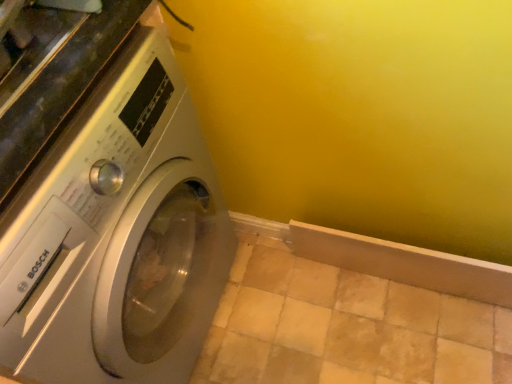
Describe the element at coordinates (103, 200) in the screenshot. I see `satin silver washing machine at left` at that location.

Where is `satin silver washing machine at left`? This screenshot has height=384, width=512. satin silver washing machine at left is located at coordinates (103, 200).

Locate an element on the screen. Image resolution: width=512 pixels, height=384 pixels. satin silver washing machine at left is located at coordinates (103, 200).